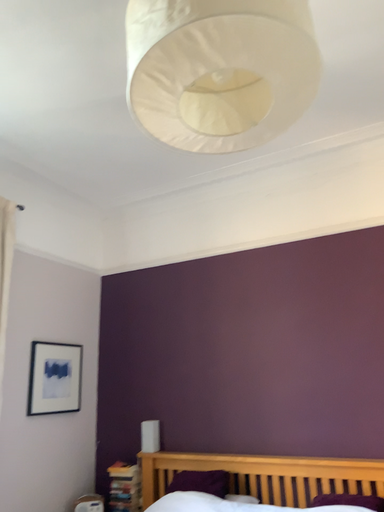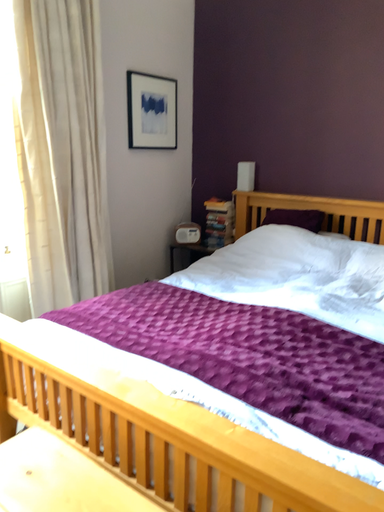
Question: How did the camera likely rotate when shooting the video?

Choices:
 (A) rotated left
 (B) rotated right

Answer: (A)